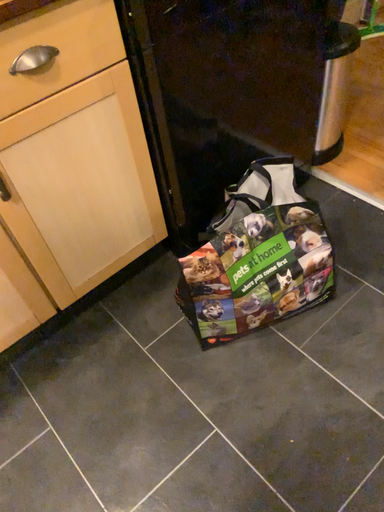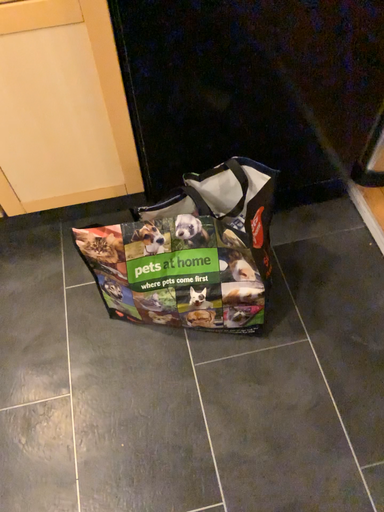
Question: Which way did the camera rotate in the video?

Choices:
 (A) rotated left
 (B) rotated right

Answer: (A)